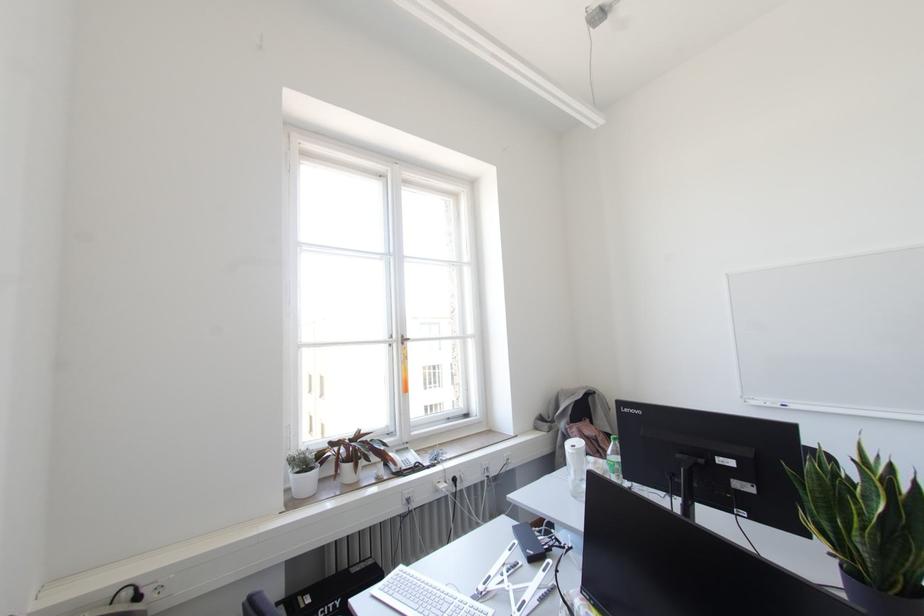
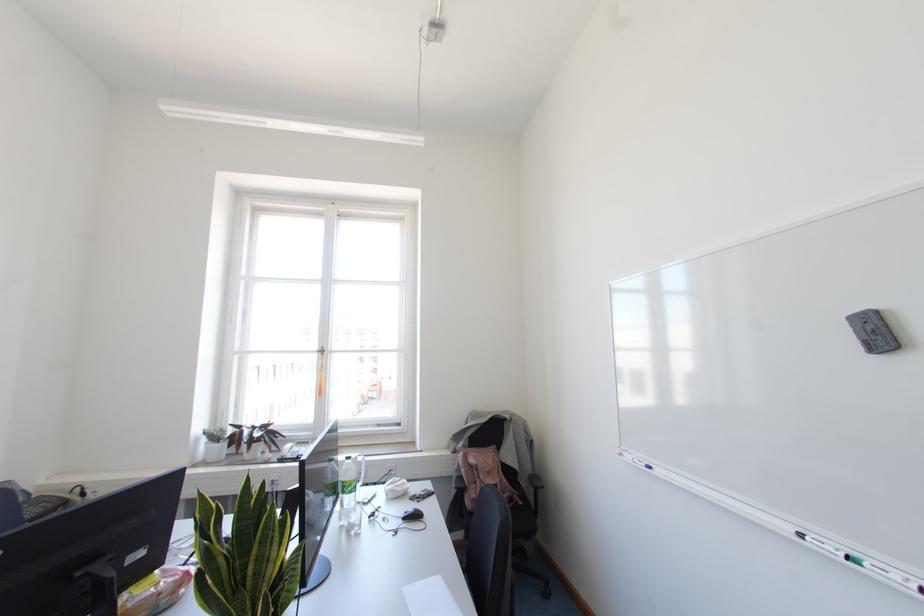
Find the pixel in the second image that matches point 402,342 in the first image.

(322, 353)